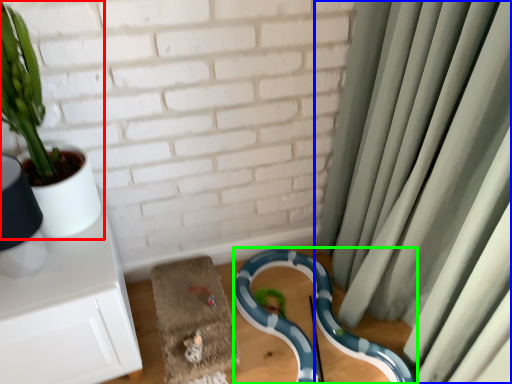
Question: Estimate the real-world distances between objects in this image. Which object is closer to houseplant (highlighted by a red box), curtain (highlighted by a blue box) or snake (highlighted by a green box)?

Choices:
 (A) curtain
 (B) snake

Answer: (B)